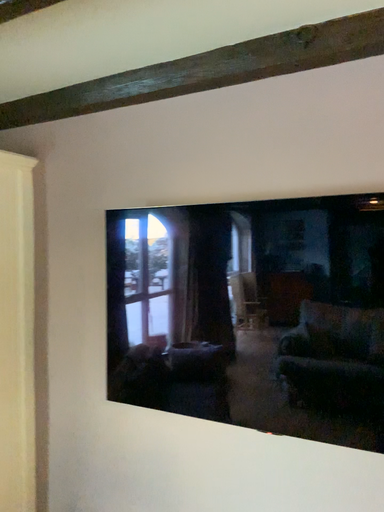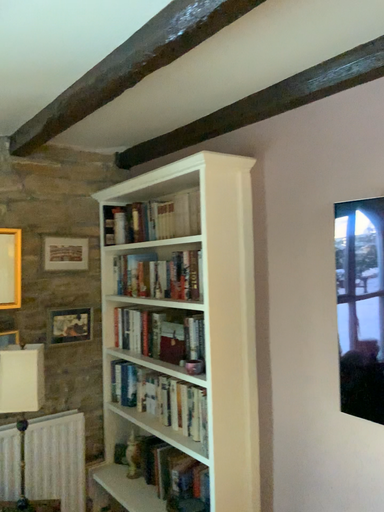
Question: How did the camera likely rotate when shooting the video?

Choices:
 (A) rotated right
 (B) rotated left

Answer: (B)